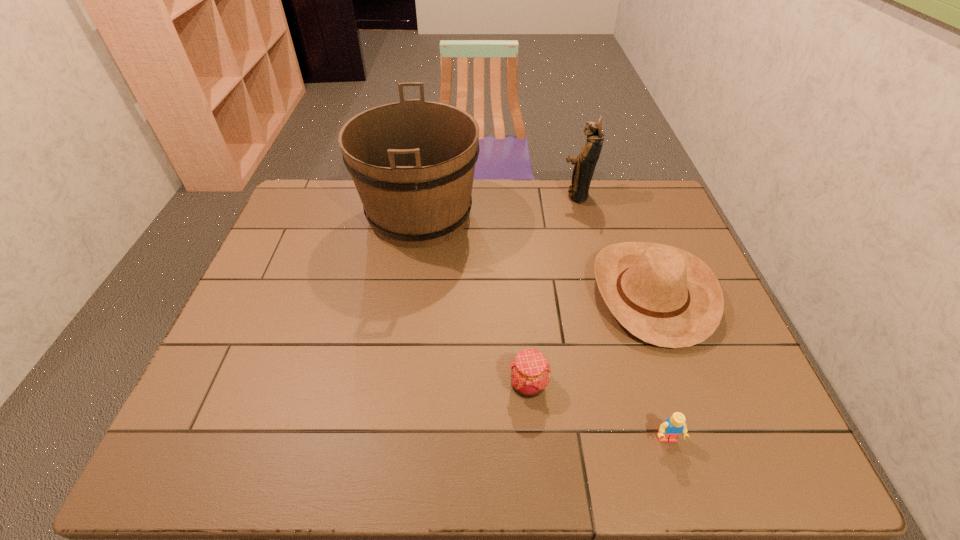
At what (x,y) coordinates should I click in order to perform the action: click on vacant position at the left edge of the desktop. Please return your answer as a coordinate pair (x, y). The width and height of the screenshot is (960, 540). Looking at the image, I should click on (280, 312).

Where is `vacant space at the right edge of the desktop`? vacant space at the right edge of the desktop is located at coordinates (721, 364).

At what (x,y) coordinates should I click in order to perform the action: click on vacant space at the far left corner of the desktop. Please return your answer as a coordinate pair (x, y). Looking at the image, I should click on (325, 184).

This screenshot has height=540, width=960. In the image, there is a desktop. Find the location of `vacant space at the near left corner`. vacant space at the near left corner is located at coordinates (228, 444).

Locate an element on the screen. vacant area between the cowboy hat and the second object from left to right is located at coordinates (589, 339).

Identify the location of vacant space in between the nearest object and the cowboy hat. This screenshot has width=960, height=540. (660, 366).

Image resolution: width=960 pixels, height=540 pixels. Find the location of `free spot between the Lego and the fourth farthest object`. free spot between the Lego and the fourth farthest object is located at coordinates (597, 412).

Where is `empty location between the figurine and the jam`? Image resolution: width=960 pixels, height=540 pixels. empty location between the figurine and the jam is located at coordinates (552, 291).

Locate an element on the screen. vacant space that's between the bucket and the fourth farthest object is located at coordinates (474, 300).

This screenshot has width=960, height=540. In order to click on empty space between the leftmost object and the jam in this screenshot , I will do `click(474, 300)`.